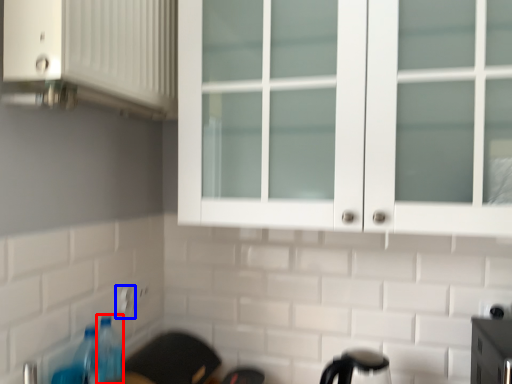
Question: Which object appears farthest to the camera in this image, bottle (highlighted by a red box) or electric outlet (highlighted by a blue box)?

Choices:
 (A) bottle
 (B) electric outlet

Answer: (B)